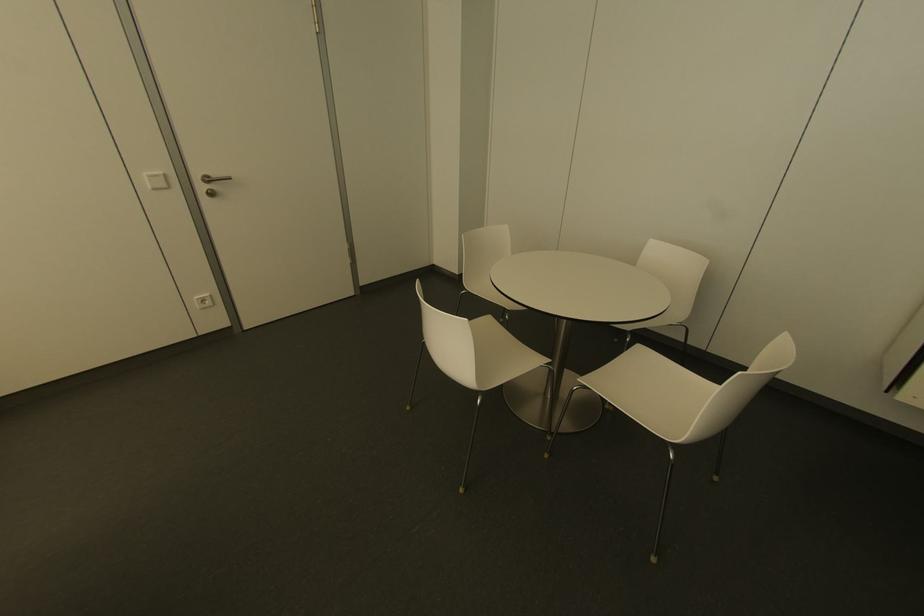
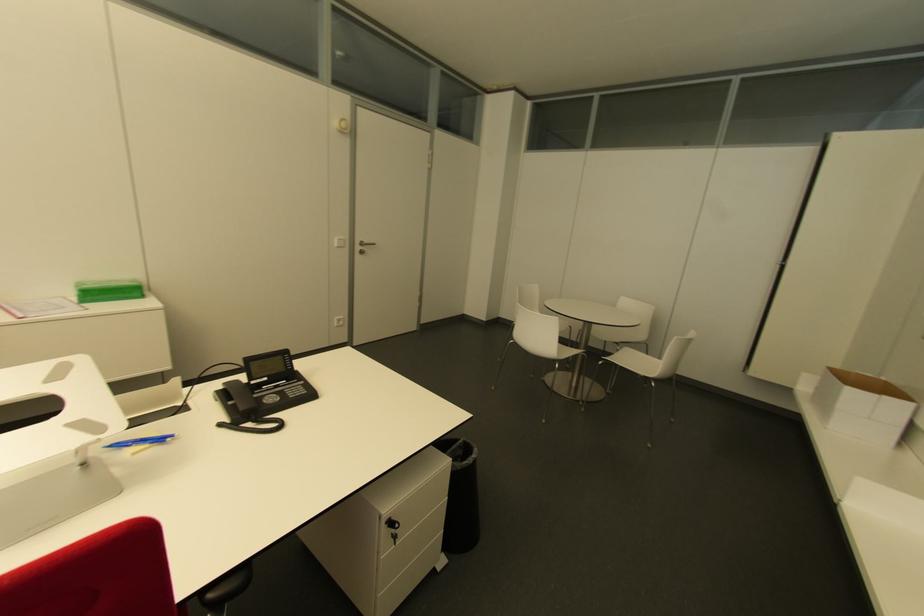
Which direction would the cameraman need to move to produce the second image?

The cameraman moved toward left, backward.